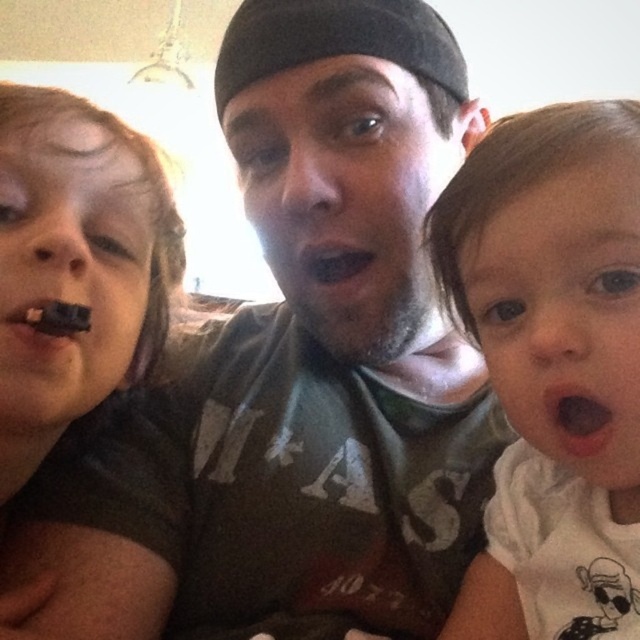
Question: Does white soft baby at right appear on the left side of chocolate matte at left?

Choices:
 (A) yes
 (B) no

Answer: (B)

Question: Estimate the real-world distances between objects in this image. Which object is closer to the white soft baby at right?

Choices:
 (A) chocolate matte at left
 (B) black matte mouth at center

Answer: (B)

Question: Which object is farther from the camera taking this photo?

Choices:
 (A) black matte mouth at center
 (B) white soft baby at right
 (C) chocolate matte at left

Answer: (A)

Question: Is white soft baby at right bigger than black matte mouth at center?

Choices:
 (A) no
 (B) yes

Answer: (B)

Question: In this image, where is white soft baby at right located relative to black matte mouth at center?

Choices:
 (A) above
 (B) below

Answer: (B)

Question: Which object is the farthest from the black matte mouth at center?

Choices:
 (A) chocolate matte at left
 (B) white soft baby at right

Answer: (B)